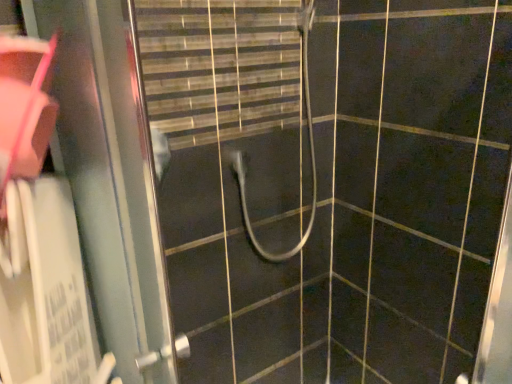
Question: From a real-world perspective, relative to metallic sliding door at left, is white rubber hose at center vertically above or below?

Choices:
 (A) above
 (B) below

Answer: (A)

Question: Would you say white rubber hose at center is to the left or to the right of metallic sliding door at left in the picture?

Choices:
 (A) left
 (B) right

Answer: (B)

Question: Is white rubber hose at center taller or shorter than metallic sliding door at left?

Choices:
 (A) tall
 (B) short

Answer: (B)

Question: Is metallic sliding door at left bigger or smaller than white rubber hose at center?

Choices:
 (A) big
 (B) small

Answer: (B)

Question: Considering the positions of point (115, 266) and point (244, 223), is point (115, 266) closer or farther from the camera than point (244, 223)?

Choices:
 (A) closer
 (B) farther

Answer: (A)

Question: Is metallic sliding door at left inside the boundaries of white rubber hose at center, or outside?

Choices:
 (A) inside
 (B) outside

Answer: (B)

Question: Is metallic sliding door at left taller or shorter than white rubber hose at center?

Choices:
 (A) short
 (B) tall

Answer: (B)